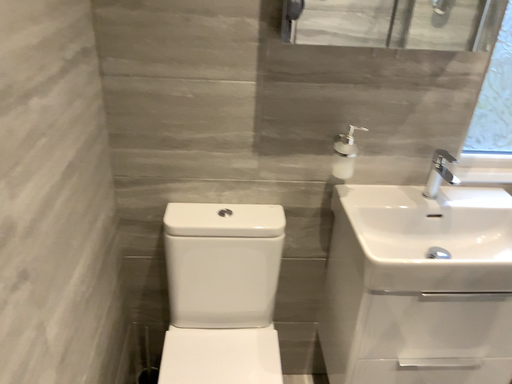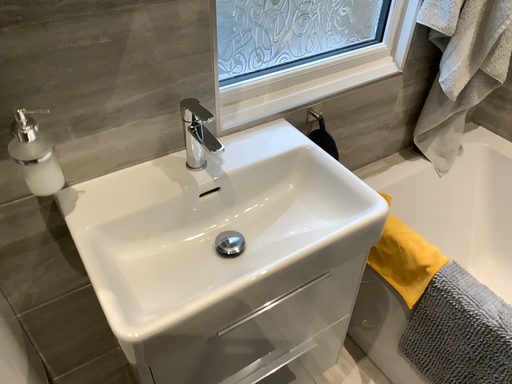
Question: Which way did the camera rotate in the video?

Choices:
 (A) rotated downward
 (B) rotated upward

Answer: (A)